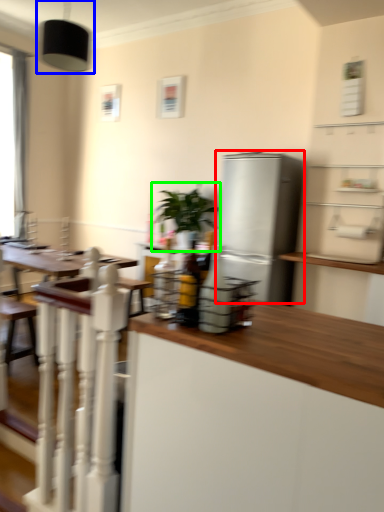
Question: Considering the real-world distances, which object is closest to refrigerator (highlighted by a red box)? light fixture (highlighted by a blue box) or houseplant (highlighted by a green box).

Choices:
 (A) light fixture
 (B) houseplant

Answer: (B)